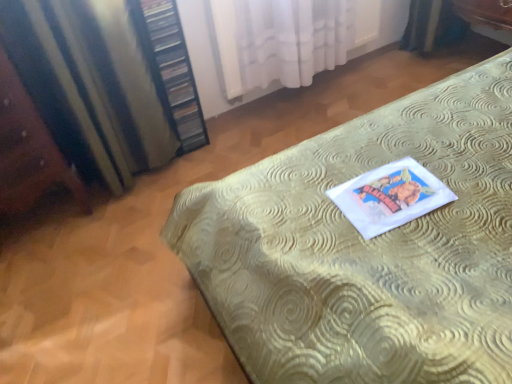
Find the location of a particular element. The image size is (512, 384). vacant area that is in front of brown wooden vanity at left is located at coordinates (47, 274).